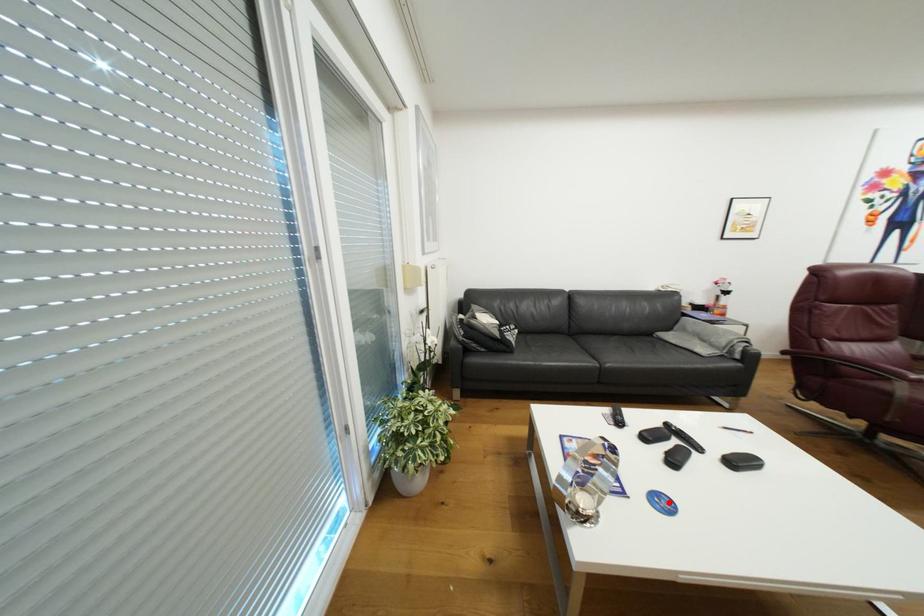
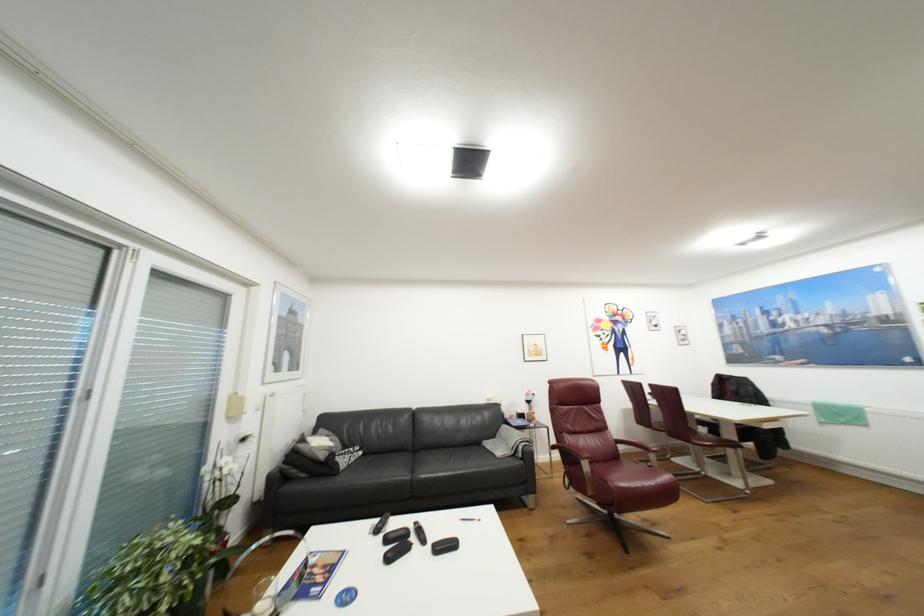
The point at the highlighted location is marked in the first image. Where is the corresponding point in the second image?

(354, 597)